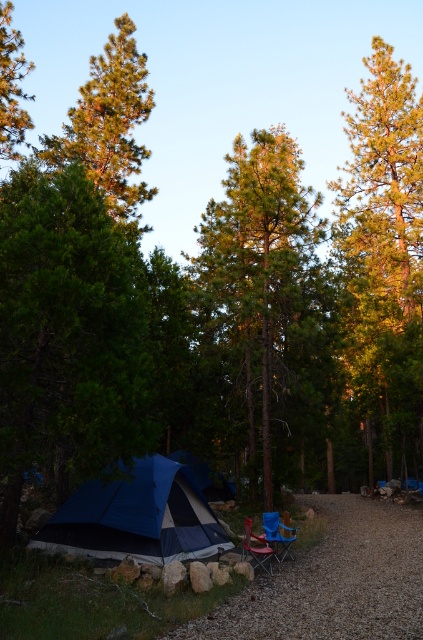
Can you confirm if green textured pine tree at right is bigger than green pine tree at left?

Correct, green textured pine tree at right is larger in size than green pine tree at left.

Between green textured pine tree at right and green pine tree at left, which one appears on the left side from the viewer's perspective?

Positioned to the left is green pine tree at left.

What are the coordinates of `green textured pine tree at right` in the screenshot? It's located at (384, 253).

Where is `green textured pine tree at right`? The image size is (423, 640). green textured pine tree at right is located at coordinates (384, 253).

From the picture: Is green textured pine tree at right further to camera compared to green textured pine tree at upper left?

Yes, green textured pine tree at right is further from the viewer.

Between green textured pine tree at right and green textured pine tree at upper left, which one is positioned higher?

green textured pine tree at upper left is above.

Does point (392, 134) come farther from viewer compared to point (145, 104)?

Yes, it is.

Where is `green textured pine tree at right`? green textured pine tree at right is located at coordinates point(384,253).

The height and width of the screenshot is (640, 423). Identify the location of green textured pine tree at upper left. (109, 125).

Is green textured pine tree at upper left below blue fabric chair at lower center?

Incorrect, green textured pine tree at upper left is not positioned below blue fabric chair at lower center.

Does point (101, 124) lie in front of point (260, 536)?

No, (101, 124) is behind (260, 536).

Where is `green textured pine tree at upper left`? The image size is (423, 640). green textured pine tree at upper left is located at coordinates click(x=109, y=125).